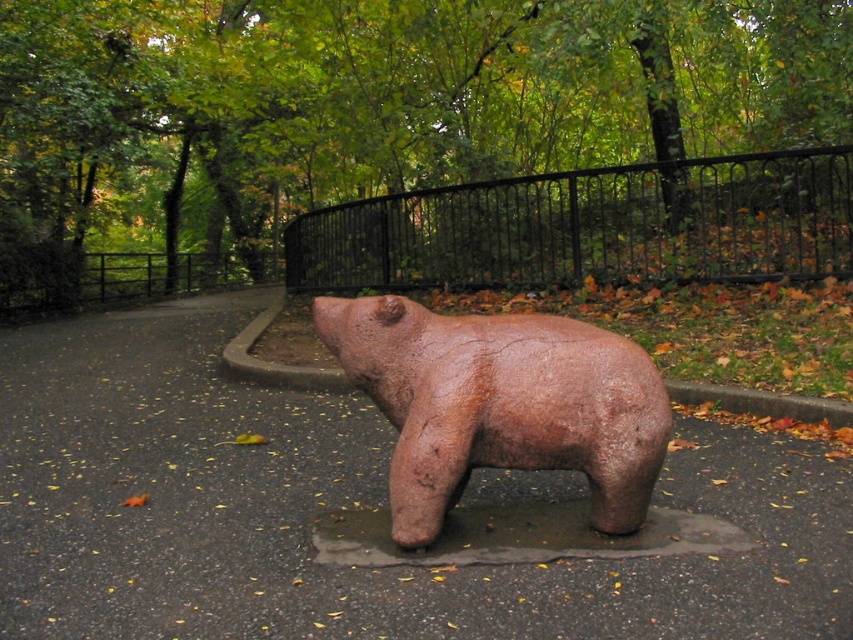
You are a visitor in the park and want to take a photo of the brown matte bear at center without the black wrought iron fence at upper center appearing in the frame. How should you adjust your position?

Move downward to lower your viewpoint so that the black wrought iron fence at upper center is no longer blocking the view of the brown matte bear at center.

You are a painter standing at the edge of the pathway in the park. You need to move your 2 meter wide canvas from the black wrought iron fence at upper center to the brown matte bear at center. Can you move it without tilting the canvas sideways?

The black wrought iron fence at upper center is wider than the brown matte bear at center. Since the canvas is 2 meters wide, you need to check if the narrower object, which is the brown matte bear at center, can accommodate the canvas. However, the description only provides a comparison between the two objects and not their exact widths. Without knowing the exact width of the brown matte bear at center, it is impossible to determine if the canvas will fit without tilting.

You are a delivery person carrying a package that is 15 feet long. You need to move it through the space between the large, reddish brown bear sculpture and the black wrought iron fence at upper center. Is the space wide enough to fit the package?

The space between the large, reddish brown bear sculpture and the black wrought iron fence at upper center is 24.07 feet wide, which is wider than the 15 feet long package. Therefore, the space is wide enough to fit the package.